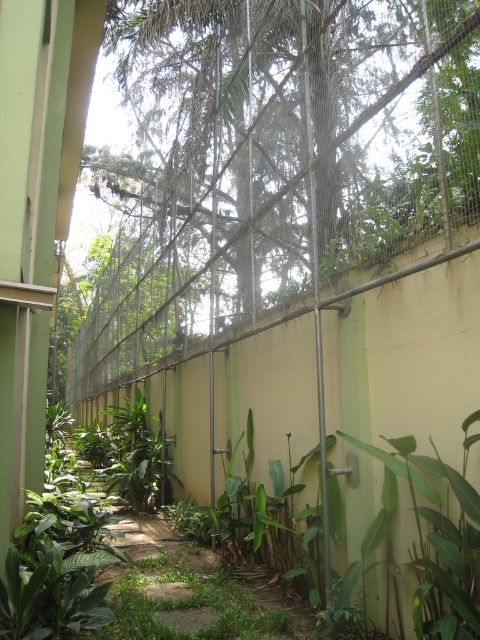
You are a zookeeper needing to transport a small animal crate through the zoo enclosure. The crate is 1 meter wide. You see the green grassy path at center and the green leafy plants at lower left. Which area can accommodate the crate without it getting stuck?

The green grassy path at center has a larger width than the green leafy plants at lower left, so the crate can be transported through the green grassy path at center since its width is sufficient to accommodate the 1 meter wide crate.

You are a zookeeper planning to place a feeding station in the zoo enclosure. The feeding station requires a flat, open space that is at least 1 meter away from the mesh fence to ensure safety. Based on the image, is the green grassy path at center a suitable location for the feeding station?

The green grassy path at center is located at point (193, 588). Since the feeding station needs to be at least 1 meter away from the mesh fence, and the path is centrally located, it is likely far enough from the fence to be suitable. However, without specific distance measurements, this is an approximation.

You are a zookeeper planning to mow the green grassy path at center and the green leafy plants at lower left. Which area requires a taller mower blade height setting to accommodate their growth?

The green leafy plants at lower left require a taller mower blade height setting because they are taller than the green grassy path at center.